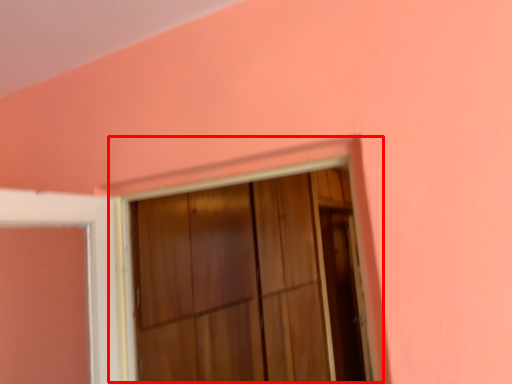
Question: Observing the image, what is the correct spatial positioning of window frame (annotated by the red box) in reference to screen door?

Choices:
 (A) left
 (B) right

Answer: (A)